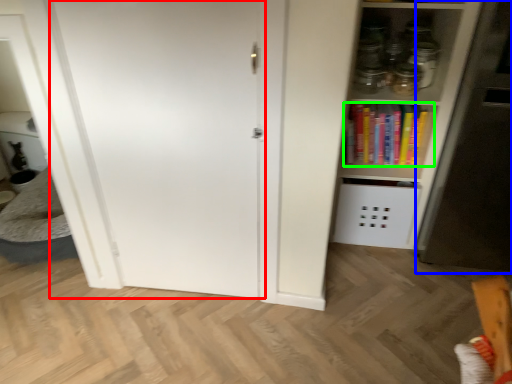
Question: Estimate the real-world distances between objects in this image. Which object is farther from door (highlighted by a red box), fridge (highlighted by a blue box) or book (highlighted by a green box)?

Choices:
 (A) fridge
 (B) book

Answer: (A)